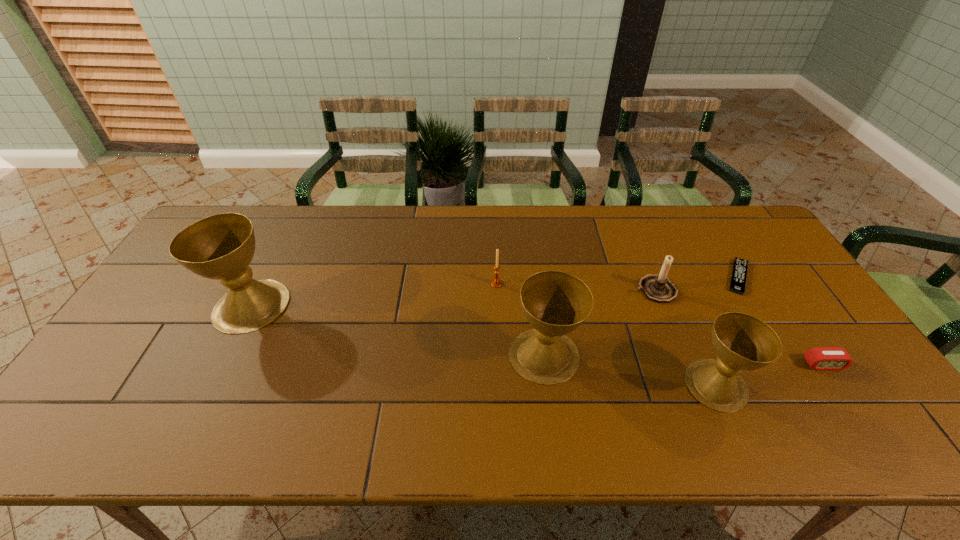
The image size is (960, 540). I want to click on the fifth closest object to the third tallest object, so click(x=496, y=282).

Identify which object is the fifth nearest to the leftmost chalice. Please provide its 2D coordinates. Your answer should be formatted as a tuple, i.e. [(x, y)], where the tuple contains the x and y coordinates of a point satisfying the conditions above.

[(738, 280)]

Locate which chalice ranks in proximity to the leftmost chalice. Please provide its 2D coordinates. Your answer should be formatted as a tuple, i.e. [(x, y)], where the tuple contains the x and y coordinates of a point satisfying the conditions above.

[(555, 303)]

The height and width of the screenshot is (540, 960). I want to click on chalice that is the closest to the sixth tallest object, so click(x=742, y=342).

Identify the location of vacant area in the image that satisfies the following two spatial constraints: 1. on the front side of the rightmost chalice; 2. on the left side of the second tallest object. Image resolution: width=960 pixels, height=540 pixels. (548, 384).